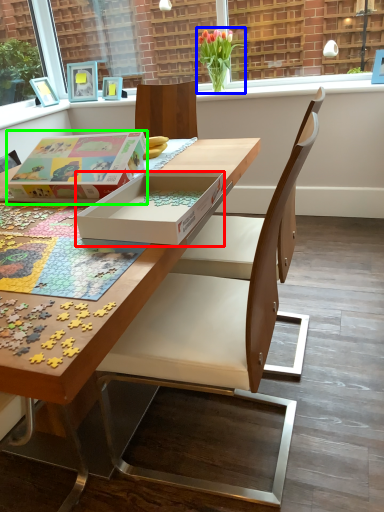
Question: Which object is the farthest from box (highlighted by a red box)? Choose among these: flower (highlighted by a blue box) or cardboard box (highlighted by a green box).

Choices:
 (A) flower
 (B) cardboard box

Answer: (A)